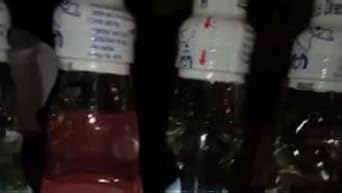
At what (x,y) coordinates should I click in order to perform the action: click on bottle. Please return your answer as a coordinate pair (x, y). The height and width of the screenshot is (193, 342). Looking at the image, I should click on point(97,135), point(204,140), point(307,144).